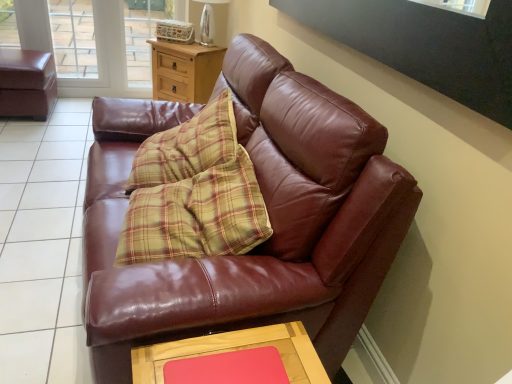
Question: From a real-world perspective, is clear glass lamp at upper center positioned over transparent glass screen door at upper left based on gravity?

Choices:
 (A) yes
 (B) no

Answer: (A)

Question: From the image's perspective, is clear glass lamp at upper center on top of transparent glass screen door at upper left?

Choices:
 (A) no
 (B) yes

Answer: (A)

Question: Would you say transparent glass screen door at upper left is part of clear glass lamp at upper center's contents?

Choices:
 (A) no
 (B) yes

Answer: (A)

Question: From the image's perspective, would you say clear glass lamp at upper center is shown under transparent glass screen door at upper left?

Choices:
 (A) yes
 (B) no

Answer: (A)

Question: Would you say clear glass lamp at upper center is outside transparent glass screen door at upper left?

Choices:
 (A) no
 (B) yes

Answer: (B)

Question: From a real-world perspective, relative to wooden table at lower center, is rubberized pink mat at lower center vertically above or below?

Choices:
 (A) above
 (B) below

Answer: (A)

Question: Is rubberized pink mat at lower center spatially inside wooden table at lower center, or outside of it?

Choices:
 (A) inside
 (B) outside

Answer: (A)

Question: Is rubberized pink mat at lower center bigger or smaller than wooden table at lower center?

Choices:
 (A) small
 (B) big

Answer: (A)

Question: Would you say rubberized pink mat at lower center is to the left or to the right of wooden table at lower center in the picture?

Choices:
 (A) right
 (B) left

Answer: (A)

Question: Is clear glass lamp at upper center wider or thinner than rubberized pink mat at lower center?

Choices:
 (A) wide
 (B) thin

Answer: (A)

Question: Relative to rubberized pink mat at lower center, is clear glass lamp at upper center in front or behind?

Choices:
 (A) behind
 (B) front

Answer: (A)

Question: Looking at the image, does clear glass lamp at upper center seem bigger or smaller compared to rubberized pink mat at lower center?

Choices:
 (A) big
 (B) small

Answer: (A)

Question: Is point (219, 34) positioned closer to the camera than point (263, 372)?

Choices:
 (A) closer
 (B) farther

Answer: (B)

Question: From the image's perspective, is transparent glass window at upper left positioned above or below transparent glass screen door at upper left?

Choices:
 (A) above
 (B) below

Answer: (B)

Question: Is transparent glass window at upper left in front of or behind transparent glass screen door at upper left in the image?

Choices:
 (A) behind
 (B) front

Answer: (B)